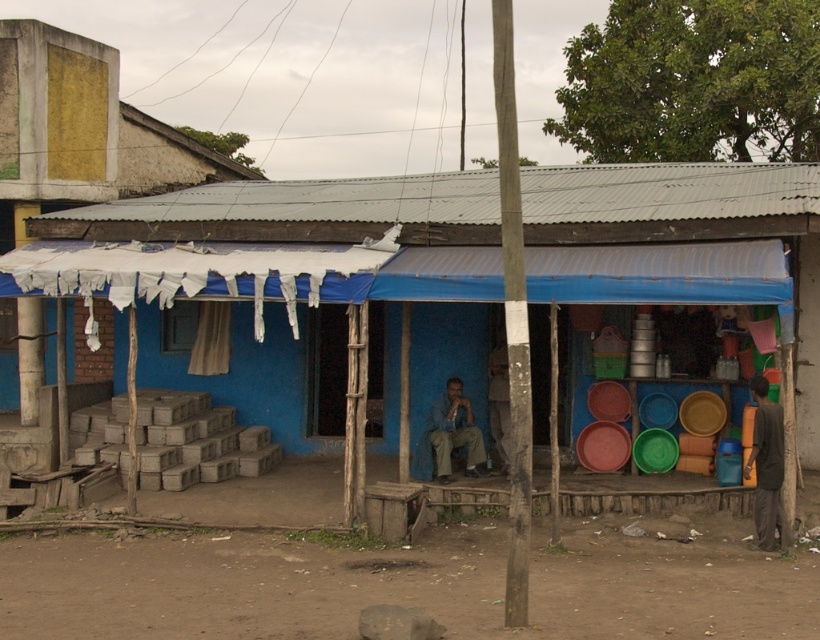
Does blue painted wood hut at center have a greater height compared to smooth wooden pole at center?

Incorrect, blue painted wood hut at center's height is not larger of smooth wooden pole at center's.

Is blue painted wood hut at center to the right of smooth wooden pole at center from the viewer's perspective?

Incorrect, blue painted wood hut at center is not on the right side of smooth wooden pole at center.

The image size is (820, 640). I want to click on blue painted wood hut at center, so click(297, 280).

Which of these two, dark gray fabric at lower right or blue fabric shirt at center, stands taller?

dark gray fabric at lower right

This screenshot has height=640, width=820. Identify the location of dark gray fabric at lower right. (766, 464).

This screenshot has height=640, width=820. In order to click on dark gray fabric at lower right in this screenshot , I will do `click(766, 464)`.

Who is lower down, smooth wooden pole at center or dark gray fabric at lower right?

Positioned lower is dark gray fabric at lower right.

Does smooth wooden pole at center lie in front of dark gray fabric at lower right?

Yes, smooth wooden pole at center is closer to the viewer.

Based on the photo, who is more distant from viewer, (500, 33) or (777, 525)?

Positioned behind is point (777, 525).

Locate an element on the screen. This screenshot has width=820, height=640. smooth wooden pole at center is located at coordinates (513, 316).